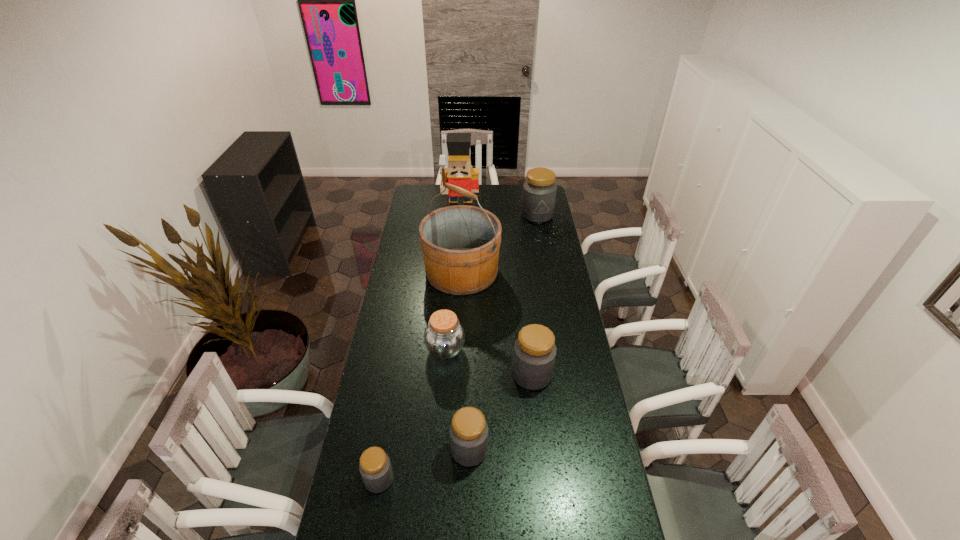
Where is `jar that is positioned at the left edge`? jar that is positioned at the left edge is located at coordinates (375, 468).

Identify the location of vacant space at the far edge of the desktop. This screenshot has height=540, width=960. (500, 197).

Image resolution: width=960 pixels, height=540 pixels. In the image, there is a desktop. Identify the location of free region at the left edge. click(402, 401).

You are a GUI agent. You are given a task and a screenshot of the screen. Output one action in this format:
    pyautogui.click(x=<x>, y=<y>)
    Task: Click on the vacant position at the right edge of the desktop
    
    Given the screenshot: What is the action you would take?
    pyautogui.click(x=568, y=325)

Where is `free space at the far left corner of the desktop`? This screenshot has width=960, height=540. free space at the far left corner of the desktop is located at coordinates (417, 205).

Identify the location of vacant space in between the leftmost gray jar and the nutcracker. This screenshot has width=960, height=540. (420, 347).

Where is `free spot between the third gray jar from right to left and the brown jar`? free spot between the third gray jar from right to left and the brown jar is located at coordinates (x=458, y=400).

Identify the location of vacant space in between the third biggest gray jar and the leftmost gray jar. (424, 464).

The width and height of the screenshot is (960, 540). Identify the location of free space between the farthest jar and the red nutcracker. (499, 215).

This screenshot has height=540, width=960. What are the coordinates of `free space between the red nutcracker and the second tallest jar` in the screenshot? It's located at (496, 294).